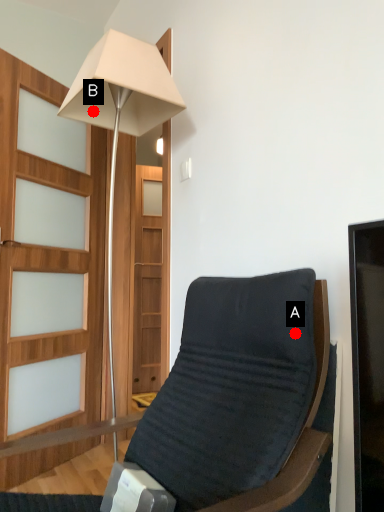
Question: Two points are circled on the image, labeled by A and B beside each circle. Which point is closer to the camera?

Choices:
 (A) A is closer
 (B) B is closer

Answer: (A)